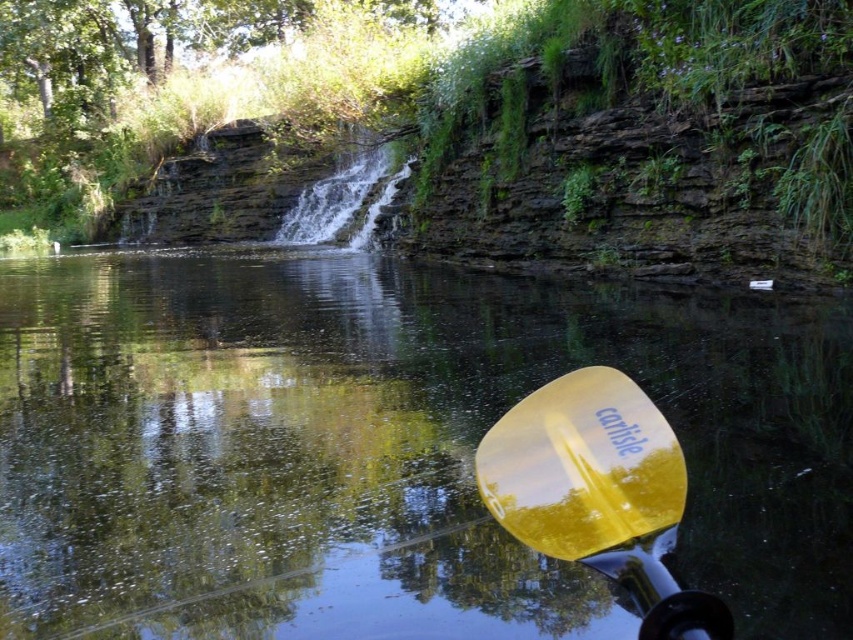
You are standing at the edge of the water in the image and want to reach both the point at coordinates (329, 358) and the point at (546, 468). Which point will you reach first while moving forward?

You will reach the point at coordinates (329, 358) first because it is closer to you than the point at (546, 468), which is further away.

You are a kayaker who wants to choose a paddle that is easier to grip in wet conditions. Based on the scene, which paddle should you choose between the transparent plastic paddle at lower right and the yellow glossy paddle at lower right?

The transparent plastic paddle at lower right has a larger size compared to yellow glossy paddle at lower right, so the transparent plastic paddle at lower right is easier to grip in wet conditions because its larger size provides a better grip surface.

You are in a kayak and see the transparent plastic paddle at lower right and the yellow glossy paddle at lower right. Which paddle is closer to you?

The transparent plastic paddle at lower right is closer to you because it is positioned over the yellow glossy paddle at lower right, indicating it is in front.